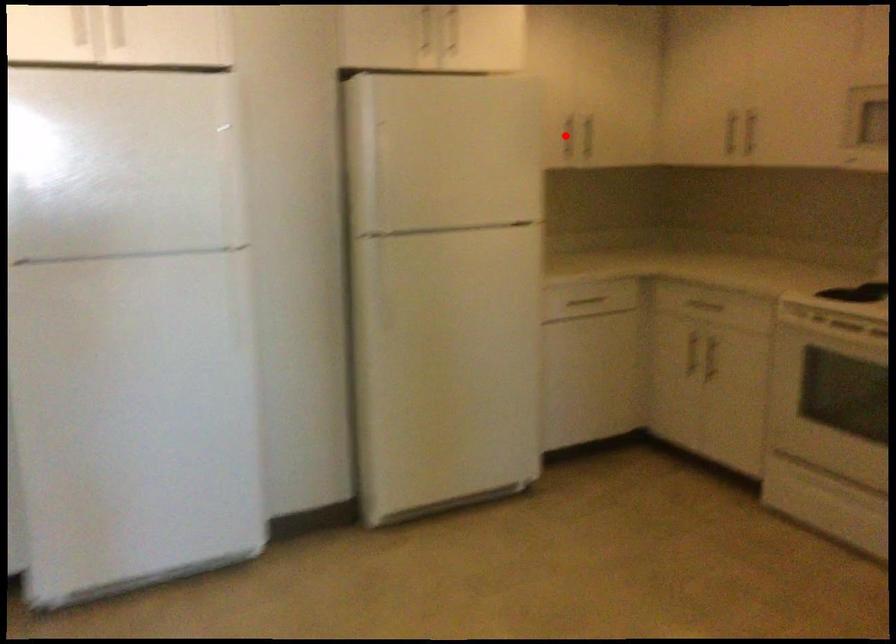
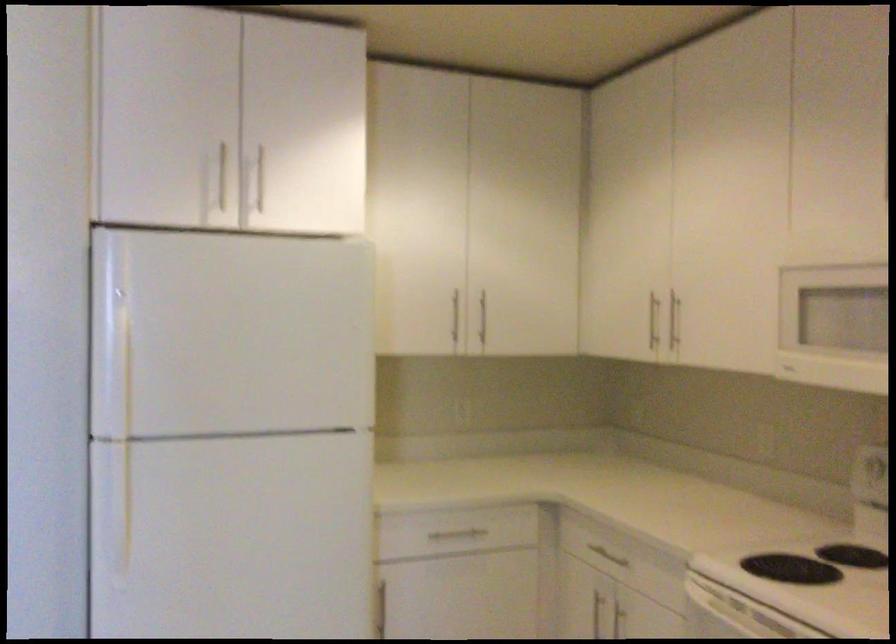
Where in the second image is the point corresponding to the highlighted location from the first image?

(454, 317)